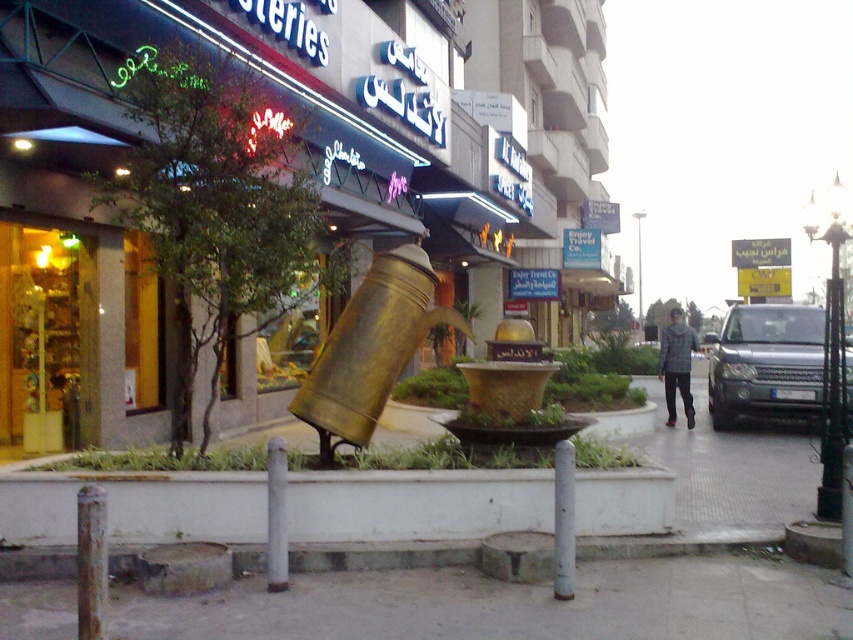
You are a delivery robot with a width of 2 feet. You need to move from the gray concrete pavement at lower center to the white concrete planter at lower center. Is there enough space for you to pass through the gap between them?

The distance between the gray concrete pavement at lower center and the white concrete planter at lower center is 5.98 feet. Since the robot is 2 feet wide, there is sufficient space for it to pass through the gap between them.

You are standing at the point marked by the coordinates point (305, 157) in the image. Based on the scene description, what object are you standing at?

You are standing at the gold metallic teapot at center, which is represented by the point (305, 157).

You are a delivery person trying to place a heavy box on the gray concrete pavement at lower center. However, there is a white concrete planter at lower center in the way. Can you move the planter to the side to make space for the box?

The gray concrete pavement at lower center is in front of the white concrete planter at lower center, meaning the planter is blocking access to the pavement. Moving the planter aside would allow space for the box.